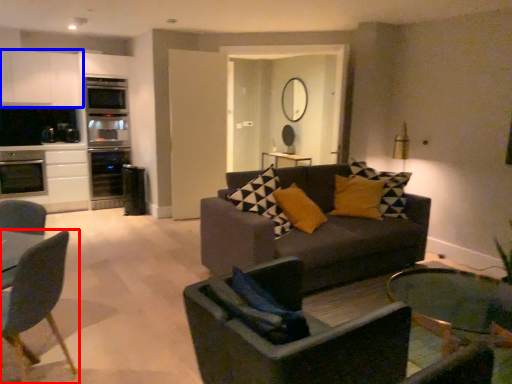
Question: Among these objects, which one is nearest to the camera, chair (highlighted by a red box) or cabinetry (highlighted by a blue box)?

Choices:
 (A) chair
 (B) cabinetry

Answer: (A)